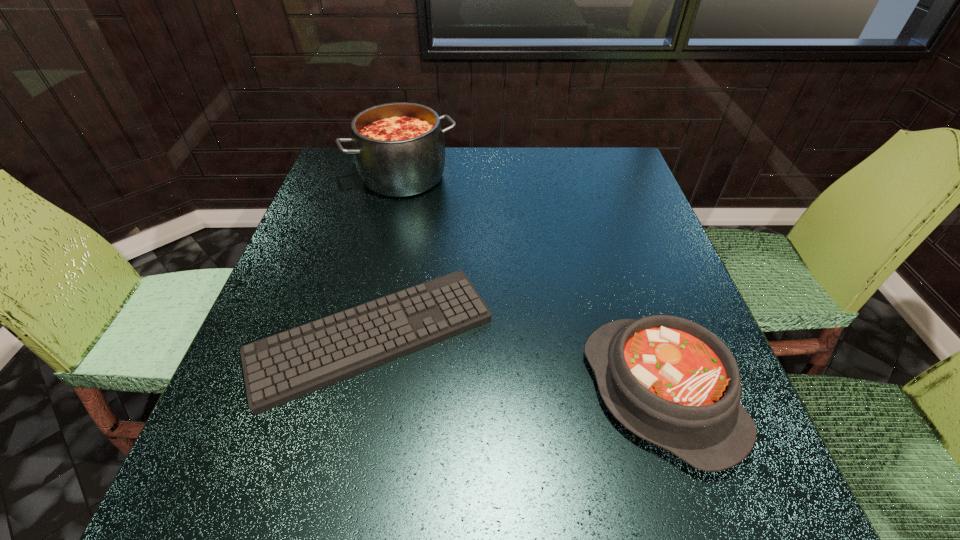
Locate an element on the screen. the tallest object is located at coordinates (399, 150).

In order to click on the taller casserole in this screenshot , I will do `click(399, 150)`.

The width and height of the screenshot is (960, 540). I want to click on the rightmost object, so click(670, 381).

Find the location of a particular element. This screenshot has width=960, height=540. the right casserole is located at coordinates (670, 381).

Where is `computer keyboard`? This screenshot has width=960, height=540. computer keyboard is located at coordinates (283, 367).

The image size is (960, 540). What are the coordinates of `vacant area situated 0.270m on the right of the taller casserole` in the screenshot? It's located at (553, 177).

Identify the location of vacant region located on the left of the shorter casserole. (519, 392).

At what (x,y) coordinates should I click in order to perform the action: click on free region located 0.120m on the front of the shortest object. Please return your answer as a coordinate pair (x, y). This screenshot has width=960, height=540. Looking at the image, I should click on (339, 490).

Image resolution: width=960 pixels, height=540 pixels. I want to click on object positioned at the far edge, so click(399, 150).

In order to click on object that is at the near edge in this screenshot , I will do `click(670, 381)`.